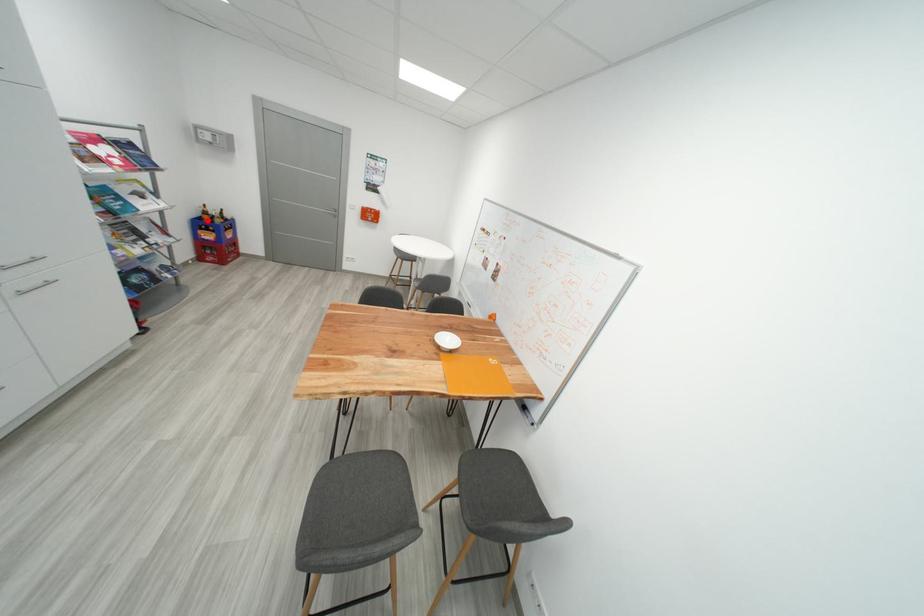
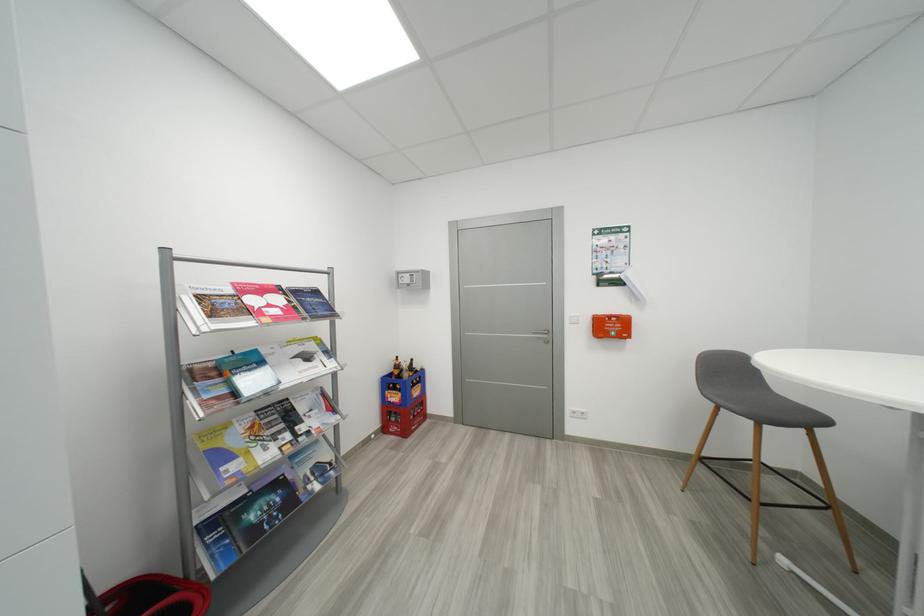
Question: A red point is marked in image1. In image2, is the corresponding 3D point closer to the camera or farther? Reply with the corresponding letter.

Choices:
 (A) The corresponding 3D point is closer.
 (B) The corresponding 3D point is farther.

Answer: (B)